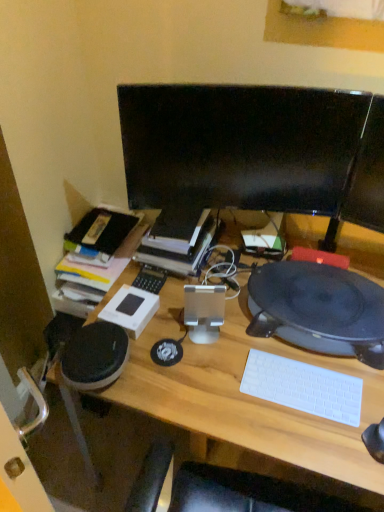
This screenshot has width=384, height=512. Find the location of `vacant space behind white plastic keyboard at lower right`. vacant space behind white plastic keyboard at lower right is located at coordinates (280, 345).